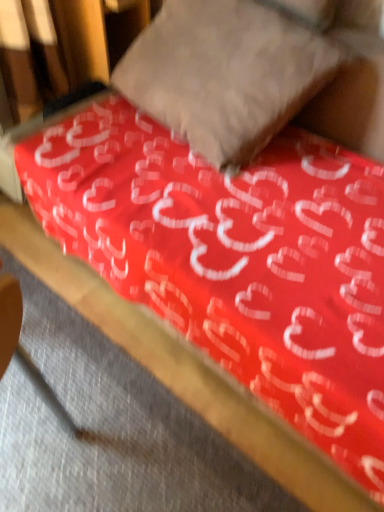
Measure the distance between matte red pillow at center and camera.

matte red pillow at center is 1.12 meters away from camera.

At what (x,y) coordinates should I click in order to perform the action: click on matte red pillow at center. Please return your answer as a coordinate pair (x, y). This screenshot has width=384, height=512. Looking at the image, I should click on (225, 74).

What do you see at coordinates (225, 74) in the screenshot?
I see `matte red pillow at center` at bounding box center [225, 74].

In order to face matte red pillow at center, should I rotate leftwards or rightwards?

Turn right approximately 2.198 degrees to face it.

You are a GUI agent. You are given a task and a screenshot of the screen. Output one action in this format:
    pyautogui.click(x=<x>, y=<y>)
    Task: Click on the matte red pillow at center
    
    Given the screenshot: What is the action you would take?
    pyautogui.click(x=225, y=74)